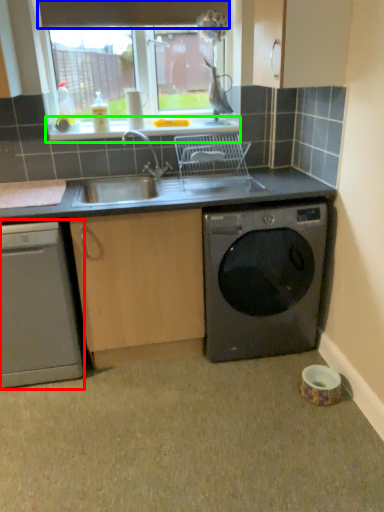
Question: Which object is positioned farthest from dishwasher (highlighted by a red box)? Select from exhaust hood (highlighted by a blue box) and window sill (highlighted by a green box).

Choices:
 (A) exhaust hood
 (B) window sill

Answer: (A)